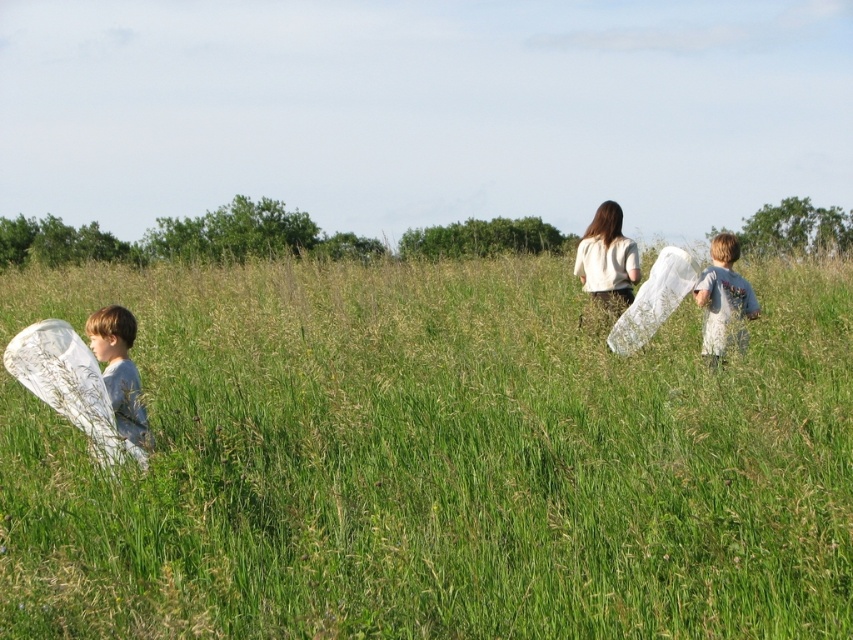
Does point (126, 348) lie behind point (630, 294)?

No.

Which is in front, point (120, 403) or point (625, 266)?

Point (120, 403) is in front.

Where is `light blue cotton shirt at left`? Image resolution: width=853 pixels, height=640 pixels. light blue cotton shirt at left is located at coordinates (120, 372).

Who is taller, white mesh net at left or light blue t-shirt at right?

With more height is white mesh net at left.

What do you see at coordinates (434, 460) in the screenshot?
I see `white mesh net at left` at bounding box center [434, 460].

Describe the element at coordinates (434, 460) in the screenshot. Image resolution: width=853 pixels, height=640 pixels. I see `white mesh net at left` at that location.

Identify the location of white mesh net at left. (434, 460).

Is light blue cotton shirt at left smaller than light blue t-shirt at right?

Yes.

Can you confirm if light blue cotton shirt at left is positioned to the right of light blue t-shirt at right?

No, light blue cotton shirt at left is not to the right of light blue t-shirt at right.

Measure the distance between point (x=126, y=422) and camera.

Point (x=126, y=422) is 19.10 feet from camera.

At what (x,y) coordinates should I click in order to perform the action: click on light blue cotton shirt at left. Please return your answer as a coordinate pair (x, y). The width and height of the screenshot is (853, 640). Looking at the image, I should click on (120, 372).